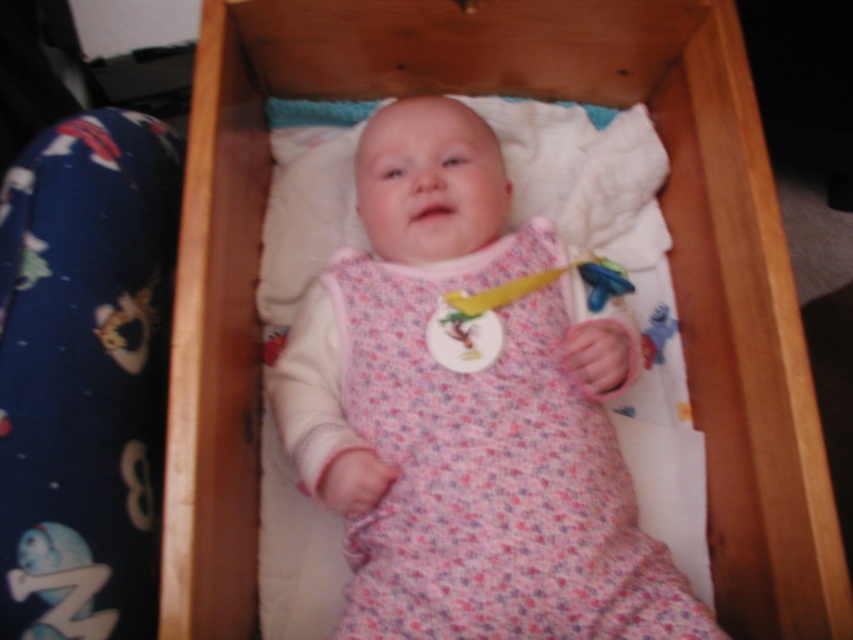
Consider the image. You are a caregiver checking on a baby in a crib. You see the pink floral fabric baby at center and the blue rubber toy at lower left. Which object is positioned higher in the image?

The pink floral fabric baby at center is located above the blue rubber toy at lower left, so it is positioned higher in the image.

You are a parent trying to hand the blue rubber toy at lower left to your baby, who is the pink floral fabric baby at center. Can you reach the baby by extending your arm 16 inches from where you are holding the toy?

The distance between the pink floral fabric baby at center and the blue rubber toy at lower left is 15.78 inches. Since your arm can extend 16 inches, you can reach the baby by extending your arm fully to hand the blue rubber toy at lower left to the pink floral fabric baby at center.

You are a parent checking the nursery for the baby. You see the blue rubber toy at lower left and the pink fabric rattle at center. Which toy is smaller?

The blue rubber toy at lower left is smaller than the pink fabric rattle at center.